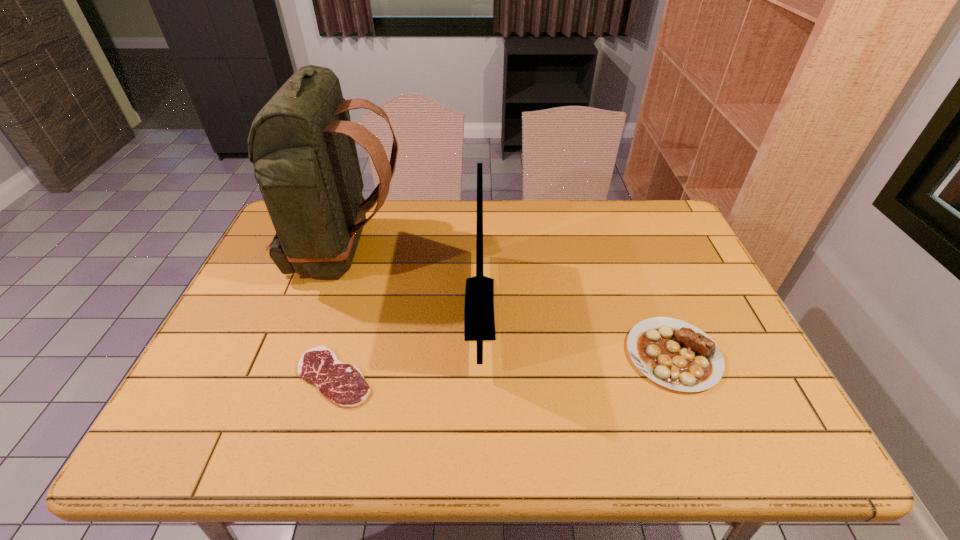
This screenshot has width=960, height=540. Identify the location of blank area located on the right of the left steak. (545, 377).

Locate an element on the screen. object situated at the far edge is located at coordinates (302, 142).

I want to click on object that is at the left edge, so click(x=302, y=142).

Where is `object at the right edge`? object at the right edge is located at coordinates (675, 354).

Find the location of a particular element. object that is positioned at the far left corner is located at coordinates (302, 142).

The image size is (960, 540). In order to click on vacant space at the far edge of the desktop in this screenshot , I will do `click(561, 204)`.

Where is `free space at the near edge of the desktop`? The width and height of the screenshot is (960, 540). free space at the near edge of the desktop is located at coordinates (581, 425).

Locate an element on the screen. The height and width of the screenshot is (540, 960). free space at the left edge is located at coordinates (262, 306).

Identify the location of vacant point at the near left corner. This screenshot has height=540, width=960. (229, 452).

Image resolution: width=960 pixels, height=540 pixels. I want to click on free space between the second shortest object and the shortest object, so click(x=504, y=366).